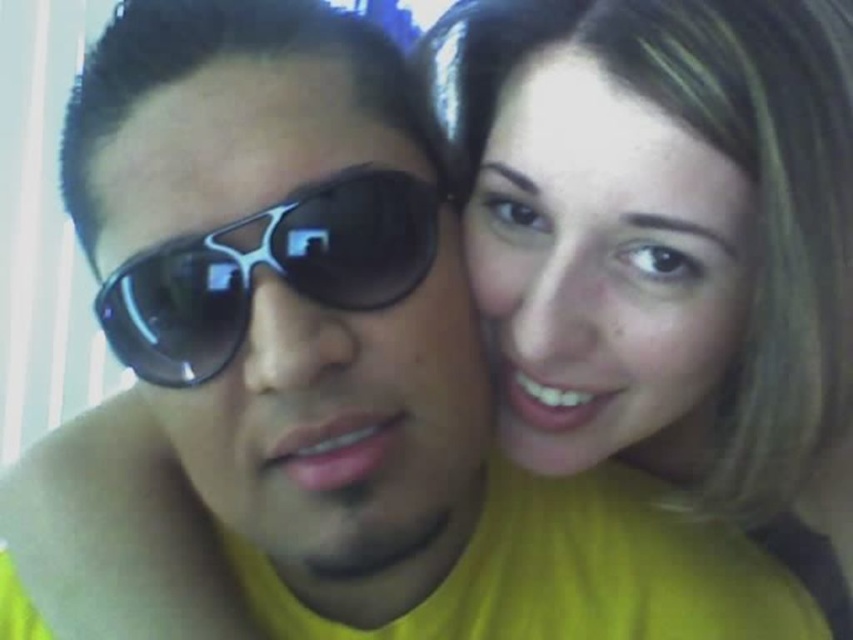
You are taking a photo of two friends in a room with vertical blinds. You notice two points in the image at coordinates point [733,292] and point [187,289]. Which point is closer to the camera?

Point [733,292] is further to the camera than point [187,289], so the point closer to the camera is point [187,289].

You are a photographer adjusting the lighting for a portrait. You notice the matte yellow shirt at upper right and the black plastic sunglasses at left in the frame. Which object is closer to you as the photographer?

The matte yellow shirt at upper right is closer to you than the black plastic sunglasses at left.

You are trying to edit a photo where two people are taking a selfie. The scene has vertical blinds in the background. You need to place a sticker exactly where the matte yellow shirt at upper right is located. What coordinates should you use?

The coordinates for the matte yellow shirt at upper right are at point (663, 241).